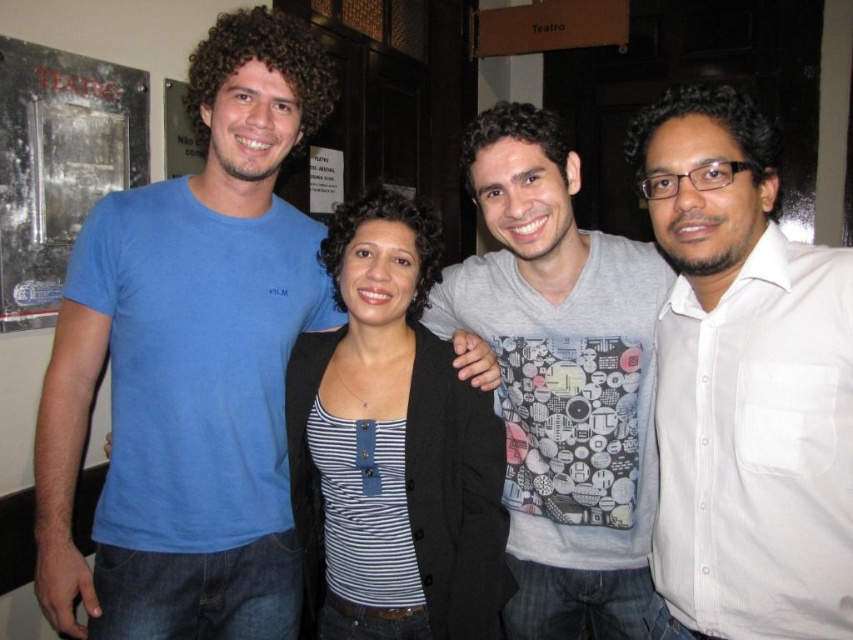
You are a photographer trying to adjust the lighting for a group photo. You notice the white shirt at right and the striped fabric top at center. Which of these two items requires more upward adjustment of the light source to avoid shadows?

The white shirt at right is taller than the striped fabric top at center, so the light source needs to be raised higher to avoid shadows on the taller white shirt at right.